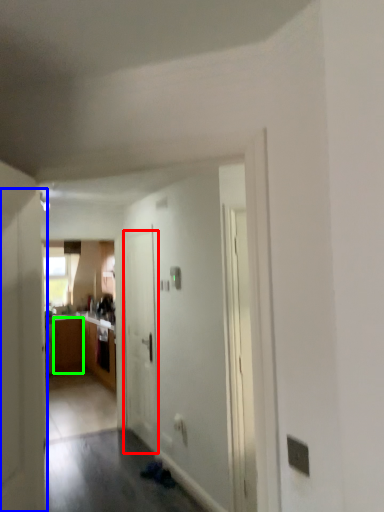
Question: Considering the real-world distances, which object is farthest from door (highlighted by a red box)? door (highlighted by a blue box) or cabinetry (highlighted by a green box)?

Choices:
 (A) door
 (B) cabinetry

Answer: (B)